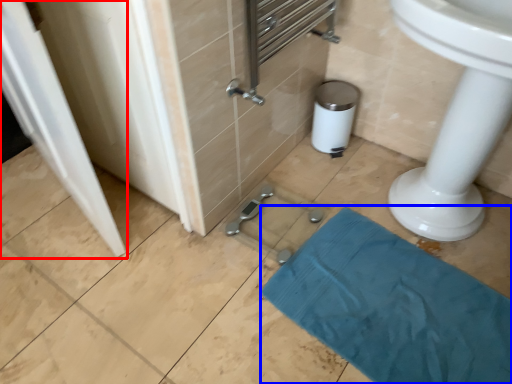
Question: Which object appears closest to the camera in this image, screen door (highlighted by a red box) or bath towel (highlighted by a blue box)?

Choices:
 (A) screen door
 (B) bath towel

Answer: (A)